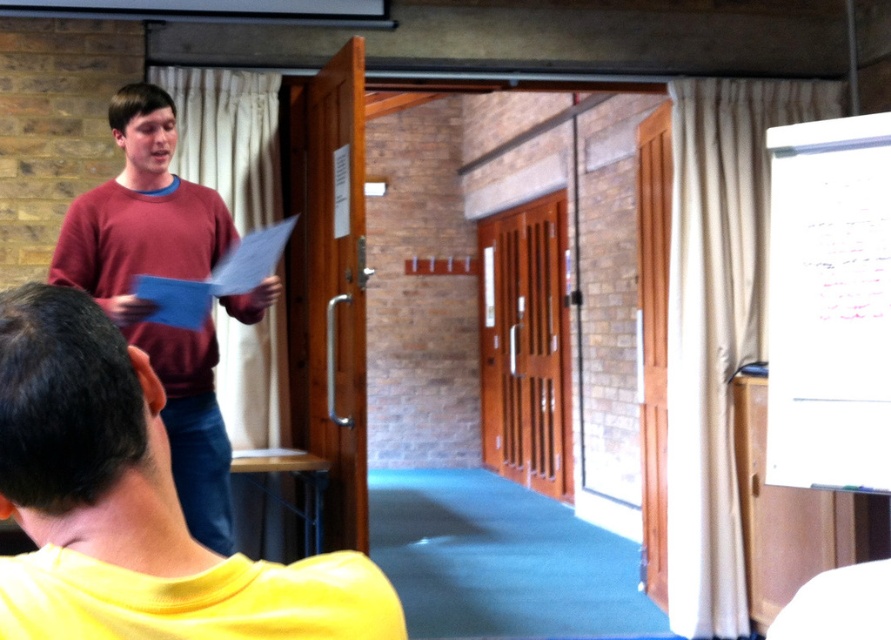
You are organizing a photo shoot and need to ensure that all clothing items in the frame are visible. Given the yellow matte shirt at lower left and the maroon sweater at left, which clothing item takes up more space in the image?

The maroon sweater at left takes up more space in the image than the yellow matte shirt at lower left, as the yellow matte shirt at lower left occupies less space than maroon sweater at left.

You are standing in the meeting room and need to locate the person wearing the maroon sweater at left. Which direction should you look relative to the yellow matte shirt at lower left?

The maroon sweater at left is to the left of the yellow matte shirt at lower left, so you should look to the left of the yellow matte shirt at lower left to find the maroon sweater at left.